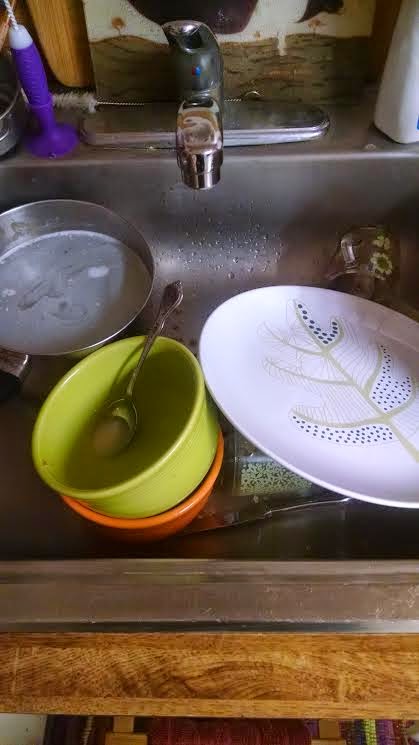
The height and width of the screenshot is (745, 419). I want to click on spoon, so click(125, 410).